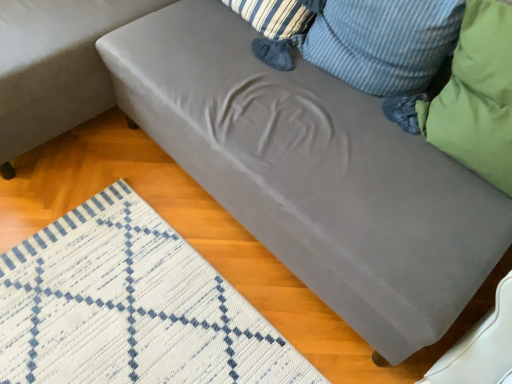
Question: Based on their sizes in the image, would you say satin gray couch at lower right is bigger or smaller than green fabric pillow at upper right, positioned as the second pillow in right-to-left order?

Choices:
 (A) big
 (B) small

Answer: (A)

Question: From the image's perspective, is satin gray couch at lower right above or below green fabric pillow at upper right, acting as the 1th pillow starting from the left?

Choices:
 (A) above
 (B) below

Answer: (A)

Question: Estimate the real-world distances between objects in this image. Which object is closer to the green fabric pillow at right, which ranks as the second pillow in left-to-right order?

Choices:
 (A) satin gray couch at lower right
 (B) green fabric pillow at upper right, acting as the 1th pillow starting from the left

Answer: (B)

Question: Which is nearer to the satin gray couch at lower right?

Choices:
 (A) green fabric pillow at upper right, positioned as the second pillow in right-to-left order
 (B) green fabric pillow at right, which ranks as the second pillow in left-to-right order

Answer: (A)